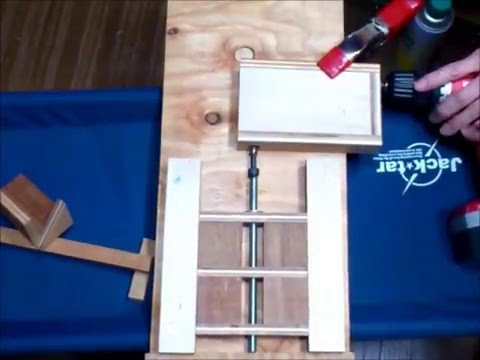
What are the coordinates of `blue sheet` in the screenshot? It's located at 380,259.